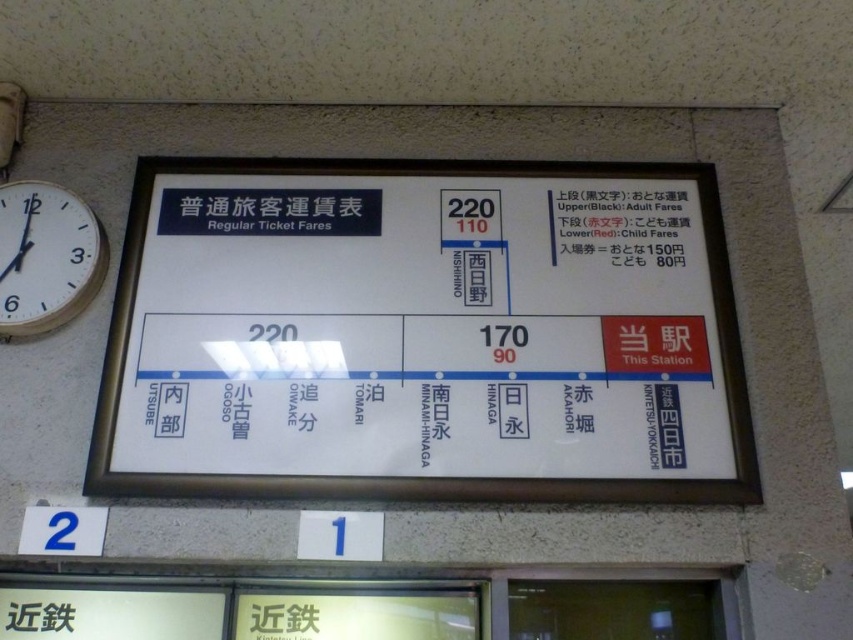
Question: Estimate the real-world distances between objects in this image. Which object is closer to the wooden clock face at left?

Choices:
 (A) white plastic signboard at upper center
 (B) black text at upper center

Answer: (A)

Question: Is wooden clock face at left thinner than black text at upper center?

Choices:
 (A) yes
 (B) no

Answer: (A)

Question: Does white plastic signboard at upper center have a smaller size compared to wooden clock face at left?

Choices:
 (A) yes
 (B) no

Answer: (B)

Question: Can you confirm if white plastic signboard at upper center is bigger than wooden clock face at left?

Choices:
 (A) no
 (B) yes

Answer: (B)

Question: Based on their relative distances, which object is nearer to the black text at upper center?

Choices:
 (A) white plastic signboard at upper center
 (B) wooden clock face at left

Answer: (A)

Question: Which point appears farthest from the camera in this image?

Choices:
 (A) (265, 282)
 (B) (596, 250)
 (C) (15, 196)

Answer: (C)